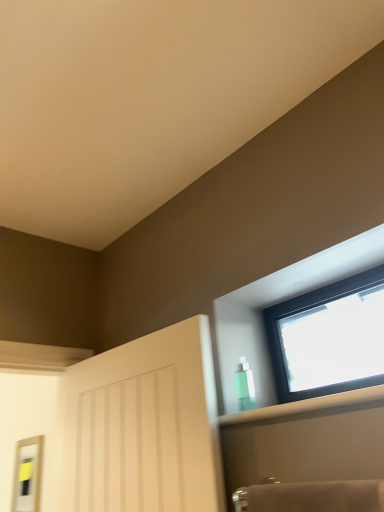
Question: Should I look upward or downward to see matte silver mirror at left?

Choices:
 (A) down
 (B) up

Answer: (A)

Question: Considering the relative positions of transparent plastic bottle at upper right and green translucent bottle at upper right in the image provided, is transparent plastic bottle at upper right to the right of green translucent bottle at upper right from the viewer's perspective?

Choices:
 (A) yes
 (B) no

Answer: (A)

Question: Does transparent plastic bottle at upper right have a greater height compared to green translucent bottle at upper right?

Choices:
 (A) yes
 (B) no

Answer: (B)

Question: Is transparent plastic bottle at upper right closer to camera compared to green translucent bottle at upper right?

Choices:
 (A) yes
 (B) no

Answer: (A)

Question: Is transparent plastic bottle at upper right not near green translucent bottle at upper right?

Choices:
 (A) no
 (B) yes

Answer: (A)

Question: Is transparent plastic bottle at upper right oriented away from green translucent bottle at upper right?

Choices:
 (A) no
 (B) yes

Answer: (A)

Question: Is transparent plastic bottle at upper right positioned behind green translucent bottle at upper right?

Choices:
 (A) yes
 (B) no

Answer: (B)

Question: Does matte silver mirror at left have a greater height compared to transparent glass window at upper right?

Choices:
 (A) yes
 (B) no

Answer: (A)

Question: Is matte silver mirror at left oriented away from transparent glass window at upper right?

Choices:
 (A) no
 (B) yes

Answer: (A)

Question: Is transparent glass window at upper right located within matte silver mirror at left?

Choices:
 (A) no
 (B) yes

Answer: (A)

Question: From a real-world perspective, is matte silver mirror at left beneath transparent glass window at upper right?

Choices:
 (A) yes
 (B) no

Answer: (A)

Question: Is matte silver mirror at left closer to the viewer compared to transparent glass window at upper right?

Choices:
 (A) no
 (B) yes

Answer: (A)

Question: Is matte silver mirror at left bigger than transparent glass window at upper right?

Choices:
 (A) yes
 (B) no

Answer: (B)

Question: Is matte silver mirror at left wider than green translucent bottle at upper right?

Choices:
 (A) no
 (B) yes

Answer: (A)